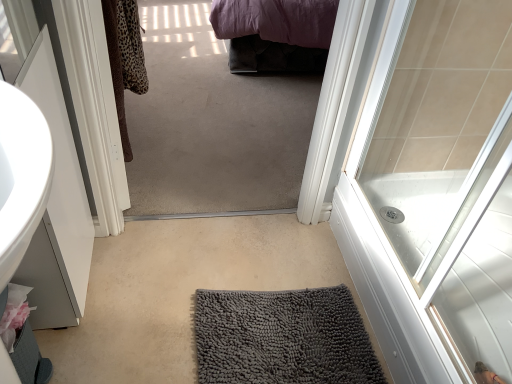
Question: Is the position of gray textured bath mat at center less distant than that of gray chenille bath mat at center?

Choices:
 (A) no
 (B) yes

Answer: (B)

Question: From a real-world perspective, is gray textured bath mat at center over gray chenille bath mat at center?

Choices:
 (A) yes
 (B) no

Answer: (B)

Question: From a real-world perspective, is gray textured bath mat at center under gray chenille bath mat at center?

Choices:
 (A) no
 (B) yes

Answer: (B)

Question: Is there a large distance between gray textured bath mat at center and gray chenille bath mat at center?

Choices:
 (A) yes
 (B) no

Answer: (B)

Question: From the image's perspective, is gray textured bath mat at center beneath gray chenille bath mat at center?

Choices:
 (A) yes
 (B) no

Answer: (B)

Question: In the image, is gray chenille bath mat at center positioned in front of or behind white glossy door at upper right?

Choices:
 (A) behind
 (B) front

Answer: (A)

Question: From the image's perspective, is gray chenille bath mat at center positioned above or below white glossy door at upper right?

Choices:
 (A) above
 (B) below

Answer: (B)

Question: Is point (270, 304) closer or farther from the camera than point (410, 175)?

Choices:
 (A) closer
 (B) farther

Answer: (A)

Question: In terms of height, does gray chenille bath mat at center look taller or shorter compared to white glossy door at upper right?

Choices:
 (A) short
 (B) tall

Answer: (A)

Question: Is gray textured bath mat at center taller or shorter than white glossy door at upper right?

Choices:
 (A) short
 (B) tall

Answer: (A)

Question: Looking at the image, does gray textured bath mat at center seem bigger or smaller compared to white glossy door at upper right?

Choices:
 (A) small
 (B) big

Answer: (A)

Question: Considering their positions, is gray textured bath mat at center located in front of or behind white glossy door at upper right?

Choices:
 (A) behind
 (B) front

Answer: (A)

Question: Which is correct: gray textured bath mat at center is inside white glossy door at upper right, or outside of it?

Choices:
 (A) inside
 (B) outside

Answer: (B)

Question: Looking at the image, does gray chenille bath mat at center seem bigger or smaller compared to gray textured bath mat at center?

Choices:
 (A) big
 (B) small

Answer: (B)

Question: In terms of height, does gray chenille bath mat at center look taller or shorter compared to gray textured bath mat at center?

Choices:
 (A) short
 (B) tall

Answer: (B)